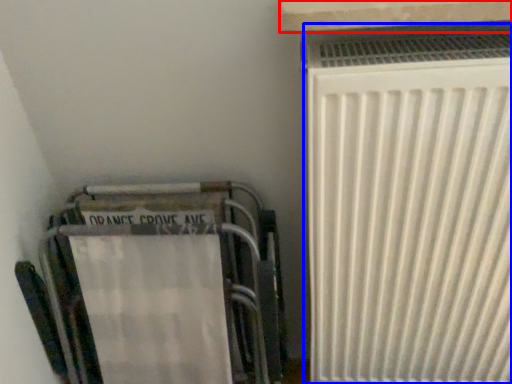
Question: Which of the following is the closest to the observer, window sill (highlighted by a red box) or radiator (highlighted by a blue box)?

Choices:
 (A) window sill
 (B) radiator

Answer: (A)